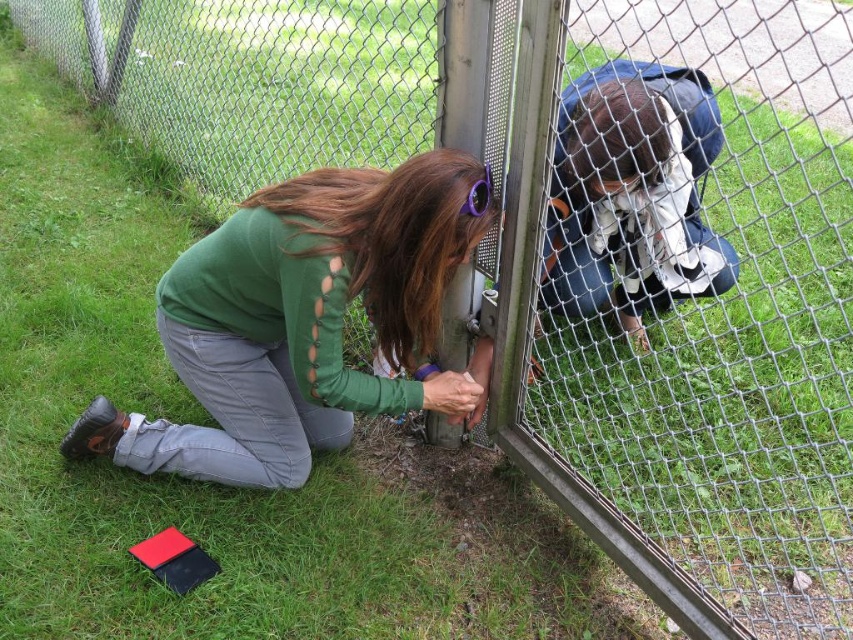
Question: Which object is the farthest from the green matte shirt at lower left?

Choices:
 (A) denim jacket at upper center
 (B) purple plastic goggles at center

Answer: (A)

Question: Which object is closer to the camera taking this photo?

Choices:
 (A) green matte shirt at lower left
 (B) denim jacket at upper center

Answer: (B)

Question: Which object appears closest to the camera in this image?

Choices:
 (A) denim jacket at upper center
 (B) green matte shirt at lower left
 (C) purple plastic goggles at center

Answer: (A)

Question: Is denim jacket at upper center to the right of purple plastic goggles at center from the viewer's perspective?

Choices:
 (A) yes
 (B) no

Answer: (A)

Question: Does green matte shirt at lower left have a smaller size compared to purple plastic goggles at center?

Choices:
 (A) no
 (B) yes

Answer: (A)

Question: Is denim jacket at upper center positioned in front of purple plastic goggles at center?

Choices:
 (A) no
 (B) yes

Answer: (B)